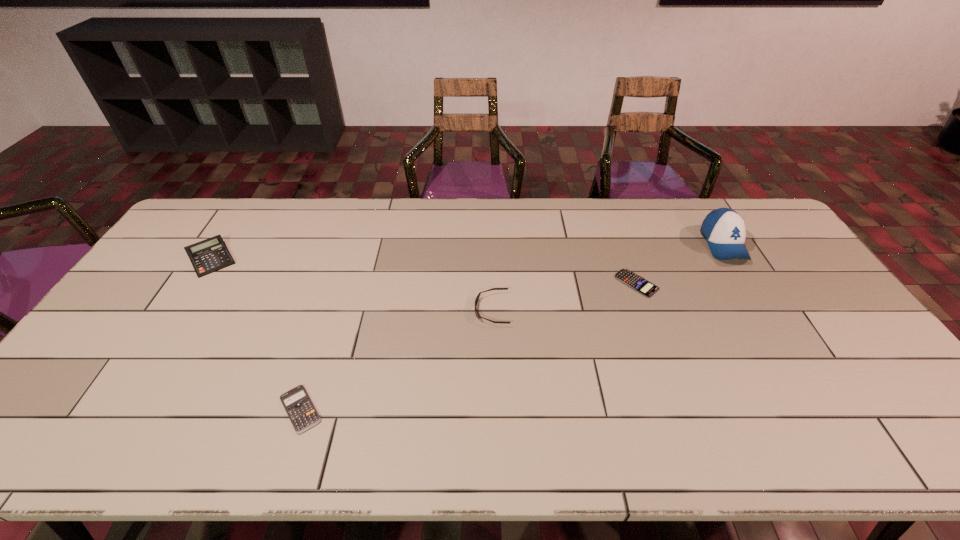
Find the location of a particular element. empty space between the baseball cap and the sunglasses is located at coordinates (608, 277).

Locate an element on the screen. Image resolution: width=960 pixels, height=540 pixels. vacant point located between the second calculator from right to left and the rightmost calculator is located at coordinates (468, 346).

The width and height of the screenshot is (960, 540). Find the location of `free space that is in between the rightmost calculator and the rightmost object`. free space that is in between the rightmost calculator and the rightmost object is located at coordinates (680, 264).

Where is `vacant space in between the third object from left to right and the second tallest object`? vacant space in between the third object from left to right and the second tallest object is located at coordinates pyautogui.click(x=351, y=284).

Locate an element on the screen. This screenshot has width=960, height=540. free space that is in between the nearest object and the fourth object from left to right is located at coordinates (468, 346).

Locate an element on the screen. The width and height of the screenshot is (960, 540). vacant space that's between the tallest object and the nearest calculator is located at coordinates click(x=512, y=327).

Locate an element on the screen. Image resolution: width=960 pixels, height=540 pixels. object identified as the second closest to the rightmost calculator is located at coordinates coord(478,316).

The width and height of the screenshot is (960, 540). Identify the location of object that is the second closest to the fourth object from left to right. (478, 316).

Find the location of a particular element. The width and height of the screenshot is (960, 540). calculator that stands as the closest to the second tallest object is located at coordinates (303, 415).

Identify the location of the second closest calculator relative to the rightmost calculator. The width and height of the screenshot is (960, 540). (210, 255).